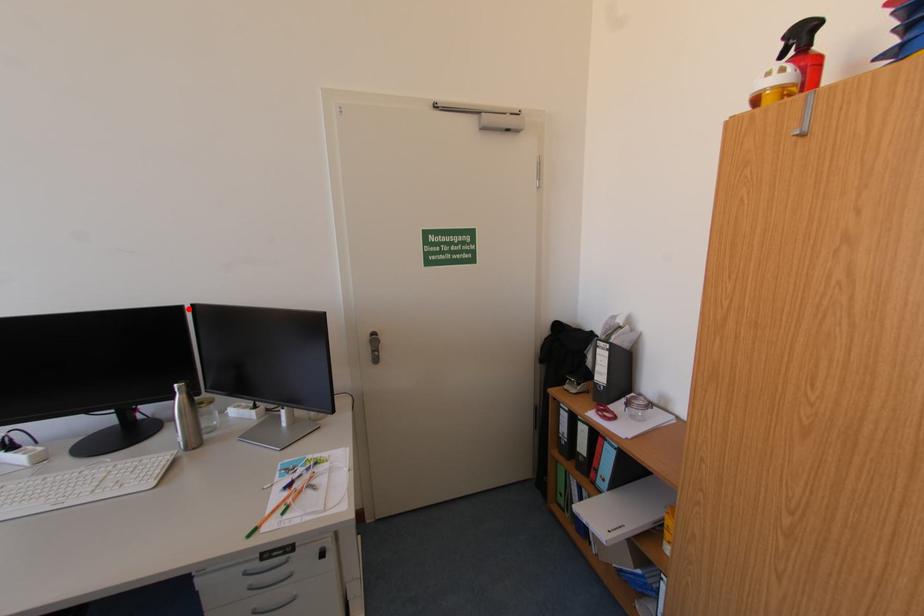
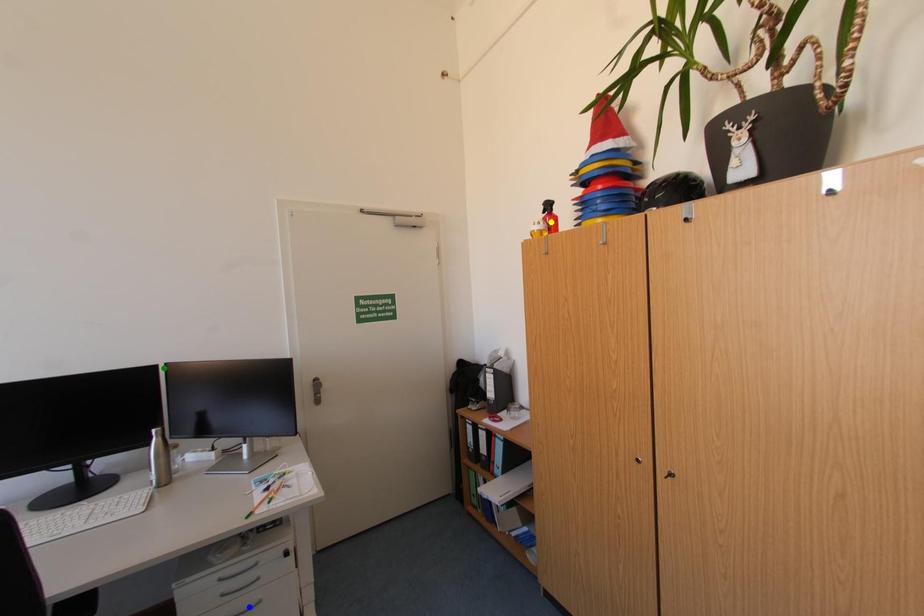
Question: I am providing you with two images of the same scene from different viewpoints. A red point is marked on the first image. You are given multiple points on the second image. Which spot in image 2 lines up with the point in image 1?

Choices:
 (A) yellow point
 (B) green point
 (C) blue point

Answer: (B)